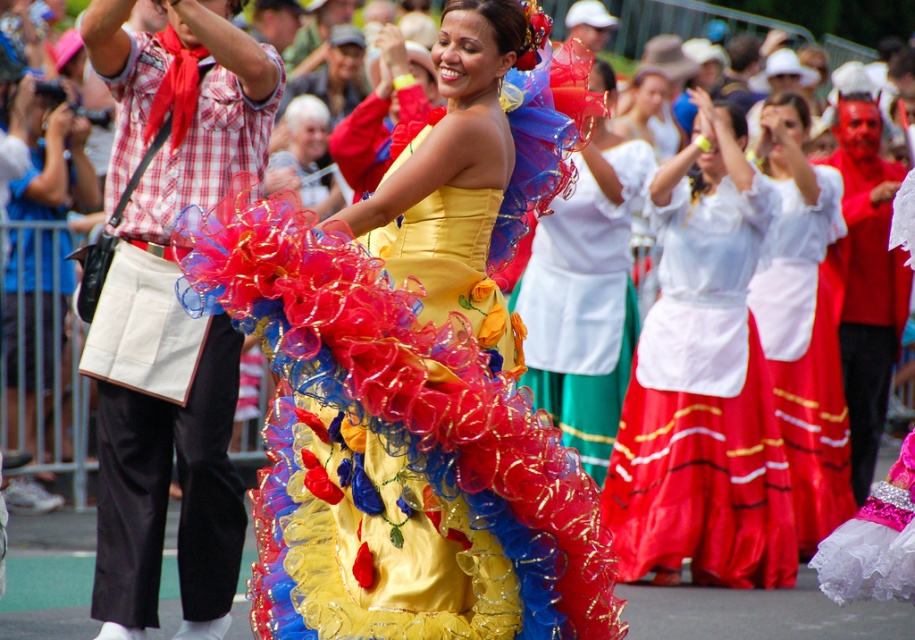
You are a photographer at the parade and want to capture both the white satin blouse at center and the white satin blouse at upper center in a single frame. Which blouse should you focus on to ensure the height difference is visible?

The white satin blouse at upper center is taller than the white satin blouse at center, so focusing on the white satin blouse at upper center will highlight the height difference.

You are a photographer at the parade and want to take a photo of both the white satin blouse at center and the white satin blouse at upper center. Which one is positioned to the left of the other?

The white satin blouse at center is to the left of white satin blouse at upper center.